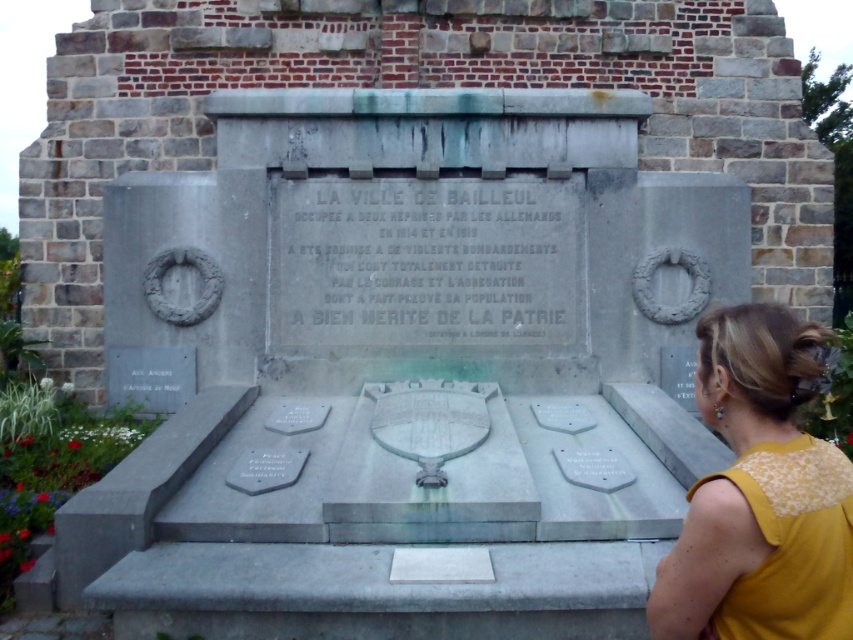
Question: Which of the following is the closest to the observer?

Choices:
 (A) (310, 460)
 (B) (782, 564)

Answer: (B)

Question: Can you confirm if polished stone plaque at center is thinner than yellow fabric at right?

Choices:
 (A) no
 (B) yes

Answer: (A)

Question: Which of the following is the closest to the observer?

Choices:
 (A) (749, 458)
 (B) (444, 474)

Answer: (A)

Question: Does polished stone plaque at center have a larger size compared to yellow fabric at right?

Choices:
 (A) yes
 (B) no

Answer: (A)

Question: Among these points, which one is farthest from the camera?

Choices:
 (A) (383, 314)
 (B) (749, 577)

Answer: (A)

Question: Can you confirm if polished stone plaque at center is thinner than yellow fabric at right?

Choices:
 (A) no
 (B) yes

Answer: (A)